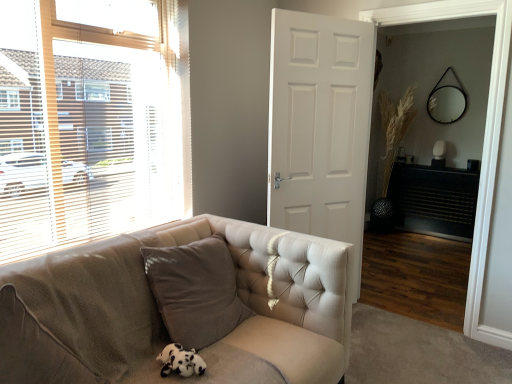
Question: Considering the relative sizes of black textured fireplace at right and wooden blinds at left in the image provided, is black textured fireplace at right thinner than wooden blinds at left?

Choices:
 (A) yes
 (B) no

Answer: (B)

Question: Can you confirm if black textured fireplace at right is positioned to the right of wooden blinds at left?

Choices:
 (A) no
 (B) yes

Answer: (B)

Question: From the image's perspective, is black textured fireplace at right above wooden blinds at left?

Choices:
 (A) yes
 (B) no

Answer: (B)

Question: Could wooden blinds at left be considered to be inside black textured fireplace at right?

Choices:
 (A) yes
 (B) no

Answer: (B)

Question: Can you confirm if black textured fireplace at right is taller than wooden blinds at left?

Choices:
 (A) yes
 (B) no

Answer: (B)

Question: From a real-world perspective, relative to white matte door at center, is black textured fireplace at right vertically above or below?

Choices:
 (A) below
 (B) above

Answer: (A)

Question: Considering the positions of point (457, 228) and point (343, 102), is point (457, 228) closer or farther from the camera than point (343, 102)?

Choices:
 (A) farther
 (B) closer

Answer: (A)

Question: Considering the relative positions of black textured fireplace at right and white matte door at center in the image provided, is black textured fireplace at right to the left or to the right of white matte door at center?

Choices:
 (A) right
 (B) left

Answer: (A)

Question: In terms of height, does black textured fireplace at right look taller or shorter compared to white matte door at center?

Choices:
 (A) short
 (B) tall

Answer: (A)

Question: Is tufted fabric couch at center in front of or behind wooden blinds at left in the image?

Choices:
 (A) behind
 (B) front

Answer: (B)

Question: Is point (124, 375) positioned closer to the camera than point (79, 114)?

Choices:
 (A) closer
 (B) farther

Answer: (A)

Question: In terms of size, does tufted fabric couch at center appear bigger or smaller than wooden blinds at left?

Choices:
 (A) small
 (B) big

Answer: (B)

Question: From the image's perspective, relative to wooden blinds at left, is tufted fabric couch at center above or below?

Choices:
 (A) above
 (B) below

Answer: (B)

Question: In terms of height, does wooden blinds at left look taller or shorter compared to wooden screen door at center?

Choices:
 (A) tall
 (B) short

Answer: (B)

Question: From a real-world perspective, is wooden blinds at left positioned above or below wooden screen door at center?

Choices:
 (A) above
 (B) below

Answer: (A)